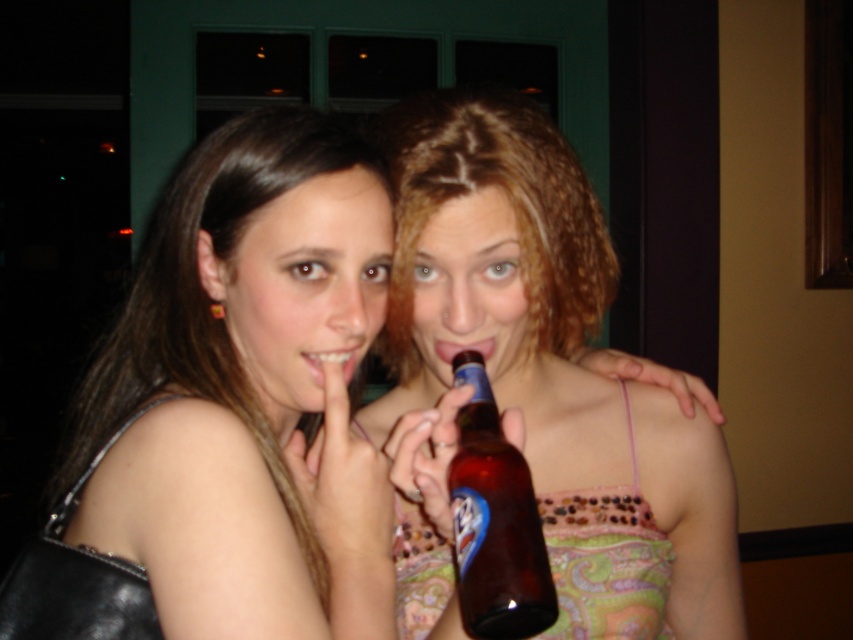
Question: Which point appears farthest from the camera in this image?

Choices:
 (A) (537, 209)
 (B) (146, 342)

Answer: (B)

Question: Is matte black purse at left to the right of brown glass bottle at center from the viewer's perspective?

Choices:
 (A) yes
 (B) no

Answer: (B)

Question: Which point is farther to the camera?

Choices:
 (A) brown fabric dress at center
 (B) brown glass bottle at center
 (C) matte black purse at left

Answer: (A)

Question: Is brown fabric dress at center thinner than brown glass bottle at center?

Choices:
 (A) yes
 (B) no

Answer: (B)

Question: Which object appears farthest from the camera in this image?

Choices:
 (A) matte black purse at left
 (B) brown glass bottle at center
 (C) brown fabric dress at center

Answer: (C)

Question: Considering the relative positions of brown fabric dress at center and brown glass bottle at center in the image provided, where is brown fabric dress at center located with respect to brown glass bottle at center?

Choices:
 (A) right
 (B) left

Answer: (A)